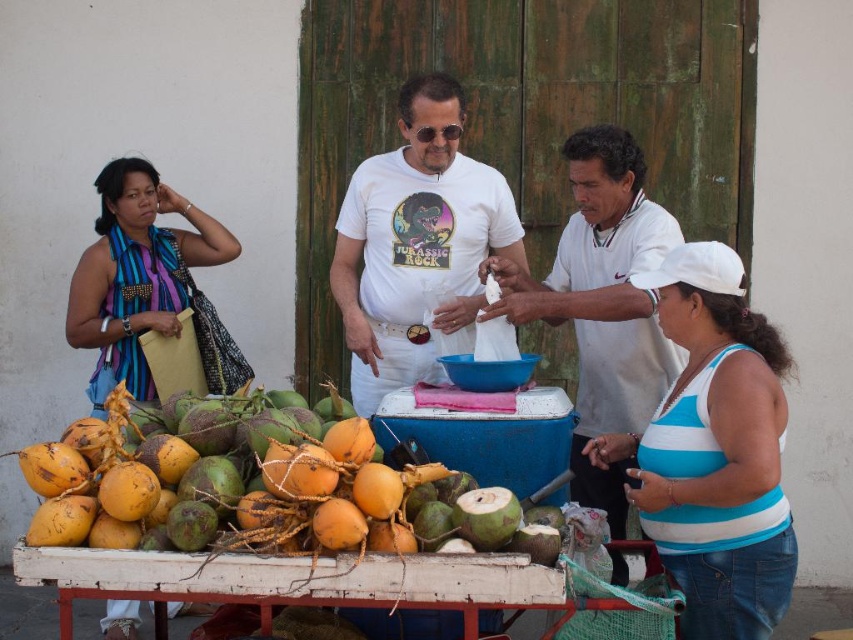
Who is positioned more to the right, blue striped scarf at left or green coconut at center?

From the viewer's perspective, green coconut at center appears more on the right side.

Is point (166, 262) positioned in front of point (474, 512)?

No, it is not.

Find the location of `blue striped scarf at left`. blue striped scarf at left is located at coordinates (146, 284).

This screenshot has height=640, width=853. In order to click on blue striped scarf at left in this screenshot , I will do `click(146, 284)`.

Can you confirm if ripe yellow coconuts at lower left is positioned below white cotton shirt at center?

Indeed, ripe yellow coconuts at lower left is positioned under white cotton shirt at center.

Between ripe yellow coconuts at lower left and white cotton shirt at center, which one has more height?

white cotton shirt at center is taller.

Which is behind, point (358, 529) or point (589, 492)?

Point (589, 492)

This screenshot has width=853, height=640. Find the location of `ripe yellow coconuts at lower left`. ripe yellow coconuts at lower left is located at coordinates (239, 497).

Is white wooden table at lower center below green coconut at center?

Yes, white wooden table at lower center is below green coconut at center.

Is white wooden table at lower center to the left of green coconut at center from the viewer's perspective?

Yes, white wooden table at lower center is to the left of green coconut at center.

At what (x,y) coordinates should I click in order to perform the action: click on white wooden table at lower center. Please return your answer as a coordinate pair (x, y). Looking at the image, I should click on (291, 579).